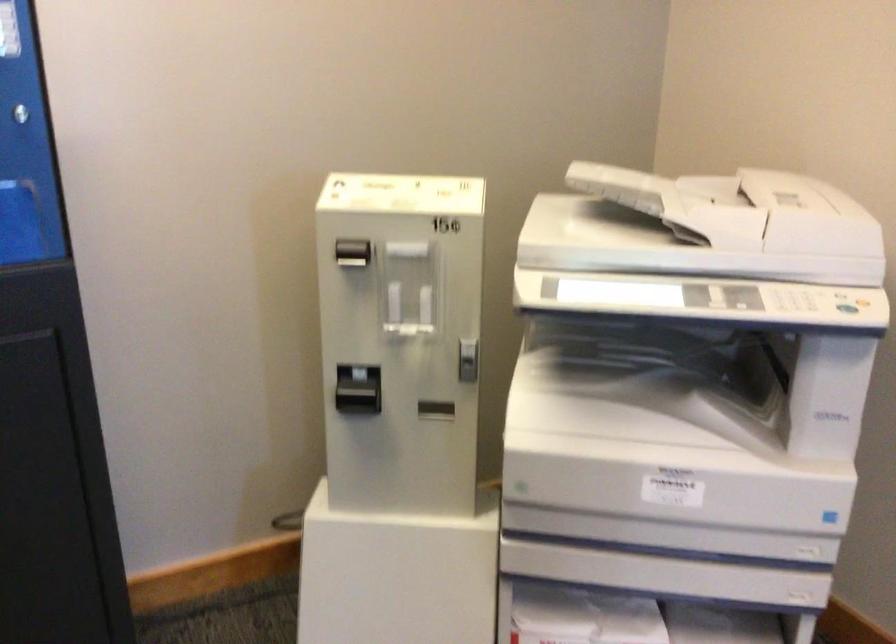
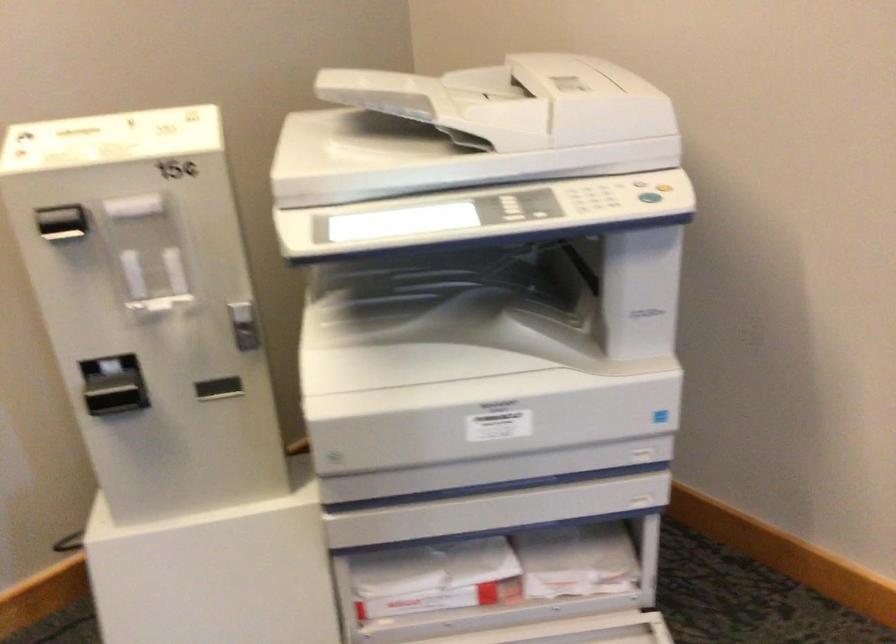
The point at (352,397) is marked in the first image. Where is the corresponding point in the second image?

(115, 393)